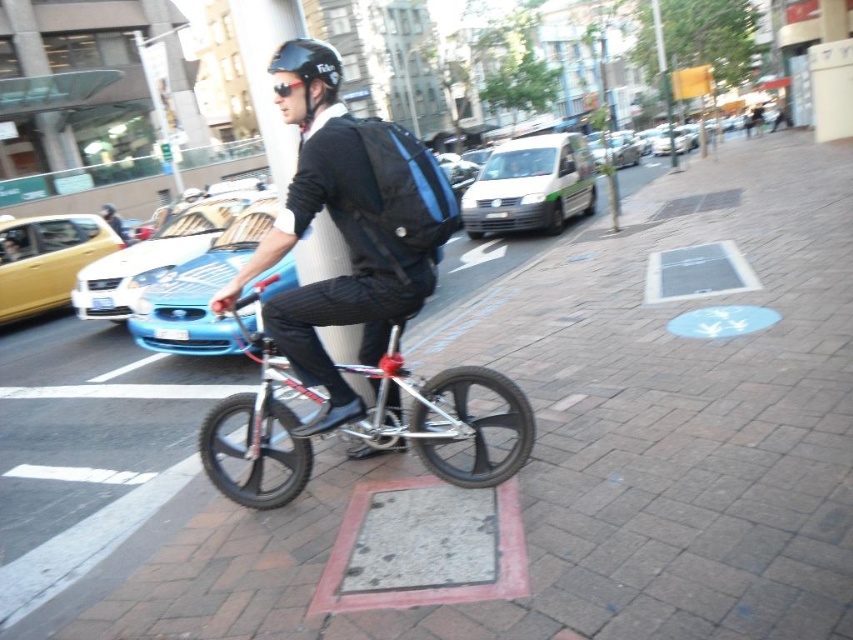
Which is below, matte black backpack at center or silver metallic bicycle at center?

Positioned lower is silver metallic bicycle at center.

Is matte black backpack at center shorter than silver metallic bicycle at center?

In fact, matte black backpack at center may be taller than silver metallic bicycle at center.

Locate an element on the screen. This screenshot has height=640, width=853. matte black backpack at center is located at coordinates (345, 227).

Does point (314, 83) come farther from viewer compared to point (260, 205)?

No, (314, 83) is closer to viewer.

Who is shorter, matte black backpack at center or metallic blue monocycle at center?

With less height is metallic blue monocycle at center.

Is point (326, 316) positioned after point (221, 268)?

No, (326, 316) is closer to viewer.

Identify the location of matte black backpack at center. The height and width of the screenshot is (640, 853). (345, 227).

Is silver metallic bicycle at center below black matte helmet at upper center?

Correct, silver metallic bicycle at center is located below black matte helmet at upper center.

Does silver metallic bicycle at center have a lesser height compared to black matte helmet at upper center?

No, silver metallic bicycle at center is not shorter than black matte helmet at upper center.

Looking at this image, who is more forward, (383,445) or (283,93)?

Positioned in front is point (283,93).

Where is `silver metallic bicycle at center`? silver metallic bicycle at center is located at coordinates (444, 417).